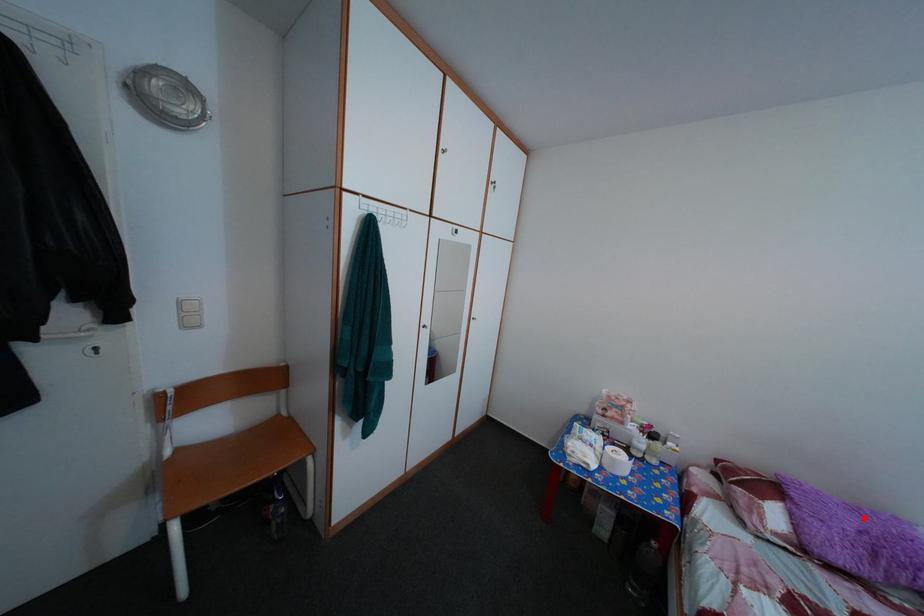
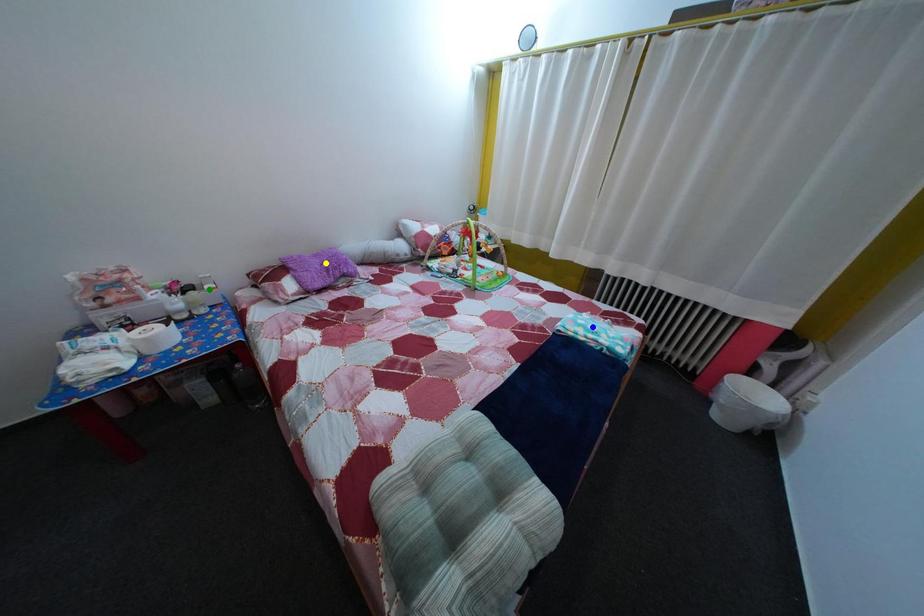
Question: I am providing you with two images of the same scene from different viewpoints. A red point is marked on the first image. You are given multiple points on the second image. Which mark in image 2 goes with the point in image 1?

Choices:
 (A) blue point
 (B) yellow point
 (C) green point

Answer: (B)